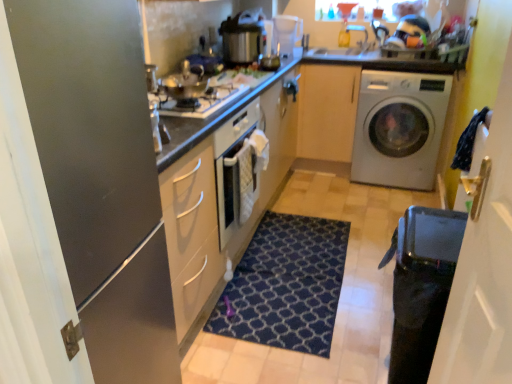
Describe the element at coordinates (399, 128) in the screenshot. I see `white glossy washing machine at right` at that location.

This screenshot has width=512, height=384. Describe the element at coordinates (200, 102) in the screenshot. I see `satin silver gas stove at center` at that location.

Measure the distance between satin silver gas stove at center and camera.

A distance of 1.65 meters exists between satin silver gas stove at center and camera.

Where is `white glossy countertop at upper center`? Image resolution: width=512 pixels, height=384 pixels. white glossy countertop at upper center is located at coordinates (393, 59).

The height and width of the screenshot is (384, 512). What do you see at coordinates (393, 59) in the screenshot?
I see `white glossy countertop at upper center` at bounding box center [393, 59].

How much space does transparent glass door at right, the 2th glass door in the left-to-right sequence, occupy horizontally?

transparent glass door at right, the 2th glass door in the left-to-right sequence, is 4.39 inches wide.

I want to click on white glossy washing machine at right, so click(x=399, y=128).

Based on the photo, from a real-world perspective, is transparent glass door at right, which is counted as the 1th glass door, starting from the right, beneath matte black refrigerator at left, arranged as the first glass door when viewed from the left?

No, from a real-world perspective, transparent glass door at right, which is counted as the 1th glass door, starting from the right, is not beneath matte black refrigerator at left, arranged as the first glass door when viewed from the left.

Identify the location of glass door above the matte black refrigerator at left, arranged as the first glass door when viewed from the left (from the image's perspective). This screenshot has width=512, height=384. (483, 261).

Is transparent glass door at right, the 2th glass door in the left-to-right sequence, turned away from matte black refrigerator at left, which appears as the 2th glass door when viewed from the right?

That's not correct — transparent glass door at right, the 2th glass door in the left-to-right sequence, is not looking away from matte black refrigerator at left, which appears as the 2th glass door when viewed from the right.

Between transparent glass door at right, the 2th glass door in the left-to-right sequence, and matte black refrigerator at left, arranged as the first glass door when viewed from the left, which one is positioned in front?

transparent glass door at right, the 2th glass door in the left-to-right sequence, is closer to the camera.

Which is correct: matte black refrigerator at left, arranged as the first glass door when viewed from the left, is inside transparent glass door at right, which is counted as the 1th glass door, starting from the right, or outside of it?

matte black refrigerator at left, arranged as the first glass door when viewed from the left, is not enclosed by transparent glass door at right, which is counted as the 1th glass door, starting from the right.

In terms of height, does matte black refrigerator at left, arranged as the first glass door when viewed from the left, look taller or shorter compared to transparent glass door at right, which is counted as the 1th glass door, starting from the right?

In the image, matte black refrigerator at left, arranged as the first glass door when viewed from the left, appears to be taller than transparent glass door at right, which is counted as the 1th glass door, starting from the right.

From the image's perspective, is matte black refrigerator at left, which appears as the 2th glass door when viewed from the right, above transparent glass door at right, which is counted as the 1th glass door, starting from the right?

Actually, matte black refrigerator at left, which appears as the 2th glass door when viewed from the right, appears below transparent glass door at right, which is counted as the 1th glass door, starting from the right, in the image.

Could you tell me if matte black refrigerator at left, arranged as the first glass door when viewed from the left, is facing transparent glass door at right, which is counted as the 1th glass door, starting from the right?

Yes, matte black refrigerator at left, arranged as the first glass door when viewed from the left, faces towards transparent glass door at right, which is counted as the 1th glass door, starting from the right.

Is metallic pressure cooker at upper center inside satin silver gas stove at center?

A: No, metallic pressure cooker at upper center is located outside of satin silver gas stove at center.

Who is taller, satin silver gas stove at center or metallic pressure cooker at upper center?

metallic pressure cooker at upper center is taller.

From a real-world perspective, is satin silver gas stove at center below metallic pressure cooker at upper center?

Yes.

Considering the sizes of objects satin silver gas stove at center and metallic pressure cooker at upper center in the image provided, who is thinner, satin silver gas stove at center or metallic pressure cooker at upper center?

metallic pressure cooker at upper center.

Which object is further away from the camera, light wood cabinet at center or metallic pressure cooker at upper center?

light wood cabinet at center is more distant.

Considering the relative positions of light wood cabinet at center and metallic pressure cooker at upper center in the image provided, is light wood cabinet at center to the left of metallic pressure cooker at upper center from the viewer's perspective?

In fact, light wood cabinet at center is to the right of metallic pressure cooker at upper center.

In the scene shown: How different are the orientations of light wood cabinet at center and metallic pressure cooker at upper center in degrees?

They differ by 93.9 degrees in their facing directions.

Would you consider light wood cabinet at center to be distant from metallic pressure cooker at upper center?

light wood cabinet at center is near metallic pressure cooker at upper center, not far away.

From the picture: From a real-world perspective, which object rests below the other?

transparent glass door at right, which is counted as the 1th glass door, starting from the right, is physically lower.

In the scene shown: Which object is wider, transparent glass door at right, which is counted as the 1th glass door, starting from the right, or metallic pressure cooker at upper center?

Wider between the two is metallic pressure cooker at upper center.

Can you tell me how much transparent glass door at right, which is counted as the 1th glass door, starting from the right, and metallic pressure cooker at upper center differ in facing direction?

transparent glass door at right, which is counted as the 1th glass door, starting from the right, and metallic pressure cooker at upper center are facing 174 degrees away from each other.

Between point (486, 174) and point (244, 46), which one is positioned behind?

The point (244, 46) is behind.

Is dark blue textured rug at center oriented towards white glossy washing machine at right?

No.

Does dark blue textured rug at center have a lesser width compared to white glossy washing machine at right?

Correct, the width of dark blue textured rug at center is less than that of white glossy washing machine at right.

Is dark blue textured rug at center positioned beyond the bounds of white glossy washing machine at right?

Indeed, dark blue textured rug at center is completely outside white glossy washing machine at right.

Which object is further away from the camera taking this photo, dark blue textured rug at center or white glossy washing machine at right?

white glossy washing machine at right is more distant.

Looking at their sizes, would you say white glossy washing machine at right is wider or thinner than light wood cabinet at center?

Considering their sizes, white glossy washing machine at right looks broader than light wood cabinet at center.

Is white glossy washing machine at right inside or outside of light wood cabinet at center?

white glossy washing machine at right is outside light wood cabinet at center.

Which is more to the right, white glossy washing machine at right or light wood cabinet at center?

white glossy washing machine at right.

Which point is more forward, (429,112) or (307,129)?

The point (429,112) is closer to the camera.

In the image, there is a transparent glass door at right, the 2th glass door in the left-to-right sequence. In order to click on glass door below it (from a real-world perspective) in this screenshot , I will do `click(101, 177)`.

The width and height of the screenshot is (512, 384). In order to click on glass door that is above the matte black refrigerator at left, arranged as the first glass door when viewed from the left (from a real-world perspective) in this screenshot , I will do `click(483, 261)`.

Considering their positions, is satin silver gas stove at center positioned closer to matte white oven at center than metallic pressure cooker at upper center?

satin silver gas stove at center lies closer to matte white oven at center than the other object.

Based on their spatial positions, is matte black refrigerator at left, which appears as the 2th glass door when viewed from the right, or transparent glass door at right, which is counted as the 1th glass door, starting from the right, further from light wood cabinet at center?

Among the two, matte black refrigerator at left, which appears as the 2th glass door when viewed from the right, is located further to light wood cabinet at center.

When comparing their distances from matte white oven at center, does metallic pressure cooker at upper center or light wood cabinet at center seem further?

Among the two, metallic pressure cooker at upper center is located further to matte white oven at center.

When comparing their distances from white glossy washing machine at right, does satin silver gas stove at center or dark blue textured rug at center seem closer?

dark blue textured rug at center lies closer to white glossy washing machine at right than the other object.

Estimate the real-world distances between objects in this image. Which object is further from dark blue textured rug at center, matte black refrigerator at left, arranged as the first glass door when viewed from the left, or matte white oven at center?

matte black refrigerator at left, arranged as the first glass door when viewed from the left, is further to dark blue textured rug at center.

Looking at the image, which one is located further to satin silver gas stove at center, transparent plastic coffee machine at upper center or white glossy washing machine at right?

white glossy washing machine at right.

Looking at the image, which one is located further to matte black refrigerator at left, arranged as the first glass door when viewed from the left, dark blue textured rug at center or light wood cabinet at center?

Among the two, light wood cabinet at center is located further to matte black refrigerator at left, arranged as the first glass door when viewed from the left.

Based on their spatial positions, is transparent glass door at right, the 2th glass door in the left-to-right sequence, or transparent plastic coffee machine at upper center closer to white glossy washing machine at right?

The object closer to white glossy washing machine at right is transparent plastic coffee machine at upper center.

The width and height of the screenshot is (512, 384). Find the location of `plain between matte black refrigerator at left, arranged as the first glass door when viewed from the left, and transparent plastic coffee machine at upper center, along the z-axis`. plain between matte black refrigerator at left, arranged as the first glass door when viewed from the left, and transparent plastic coffee machine at upper center, along the z-axis is located at coordinates (341, 289).

Locate an element on the screen. This screenshot has height=384, width=512. plain positioned between matte black refrigerator at left, arranged as the first glass door when viewed from the left, and light wood cabinet at center from near to far is located at coordinates (341, 289).

The height and width of the screenshot is (384, 512). What are the coordinates of `kitchen appliance positioned between satin silver gas stove at center and light wood cabinet at center from near to far` in the screenshot? It's located at pyautogui.click(x=243, y=38).

The image size is (512, 384). Find the location of `gas stove between transparent glass door at right, which is counted as the 1th glass door, starting from the right, and white glossy countertop at upper center in the front-back direction`. gas stove between transparent glass door at right, which is counted as the 1th glass door, starting from the right, and white glossy countertop at upper center in the front-back direction is located at coordinates (200, 102).